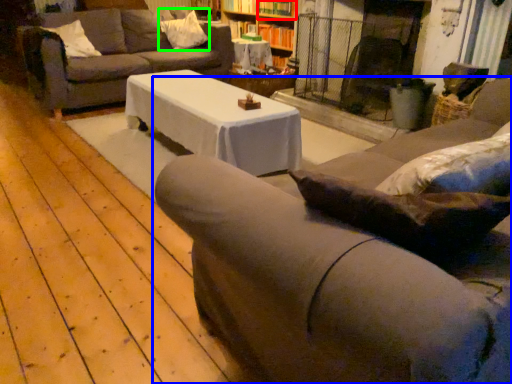
Question: Which is nearer to the shelf (highlighted by a red box)? studio couch (highlighted by a blue box) or pillow (highlighted by a green box).

Choices:
 (A) studio couch
 (B) pillow

Answer: (B)